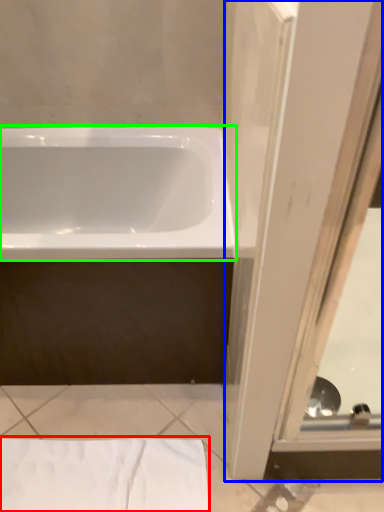
Question: Which object is positioned farthest from sheet (highlighted by a red box)? Select from screen door (highlighted by a blue box) and bathtub (highlighted by a green box).

Choices:
 (A) screen door
 (B) bathtub

Answer: (B)